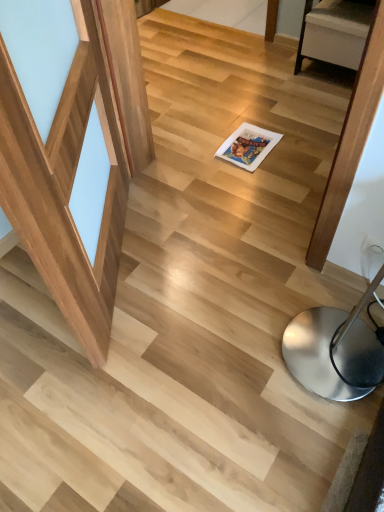
What do you see at coordinates (248, 146) in the screenshot? I see `matte paper magazine at center` at bounding box center [248, 146].

Identify the location of matte paper magazine at center. The height and width of the screenshot is (512, 384). [248, 146].

Image resolution: width=384 pixels, height=512 pixels. Identify the location of matte paper magazine at center. (248, 146).